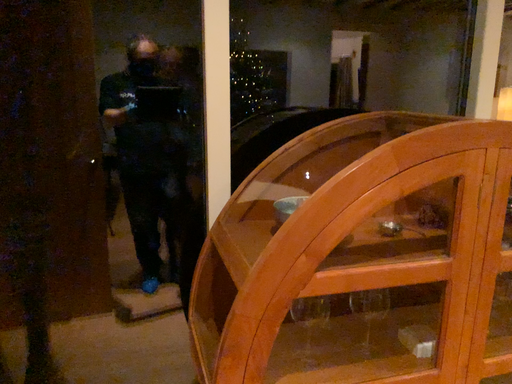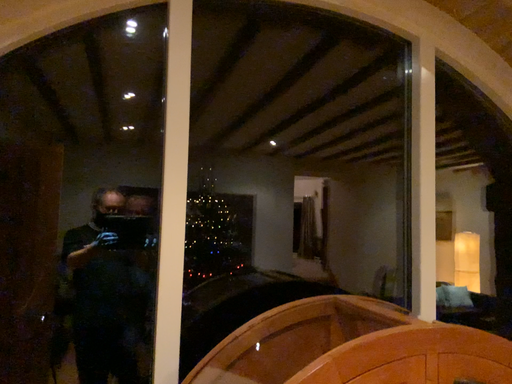
Question: Which way did the camera rotate in the video?

Choices:
 (A) rotated upward
 (B) rotated downward

Answer: (A)